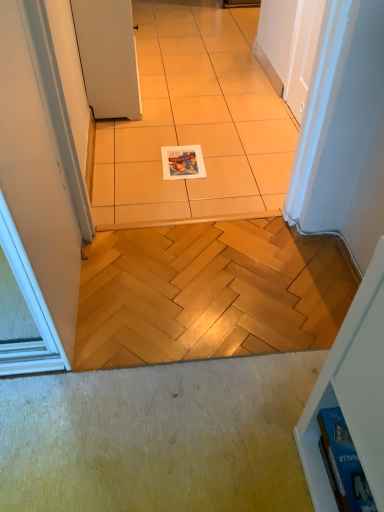
Question: Considering the positions of white matte door at upper left and beige ceramic tile at center in the image, is white matte door at upper left taller or shorter than beige ceramic tile at center?

Choices:
 (A) tall
 (B) short

Answer: (A)

Question: Is white matte door at upper left in front of or behind beige ceramic tile at center in the image?

Choices:
 (A) behind
 (B) front

Answer: (A)

Question: Which object is positioned closest to the white matte door at upper left?

Choices:
 (A) matte paper magazine at center, placed as the first magazine when sorted from back to front
 (B) beige ceramic tile at center
 (C) blue glossy magazine at lower right, the 1th magazine from the right

Answer: (B)

Question: Considering the real-world distances, which object is farthest from the matte paper magazine at center, the second magazine from the right?

Choices:
 (A) blue glossy magazine at lower right, which is the first magazine in front-to-back order
 (B) beige ceramic tile at center
 (C) white matte door at upper left

Answer: (A)